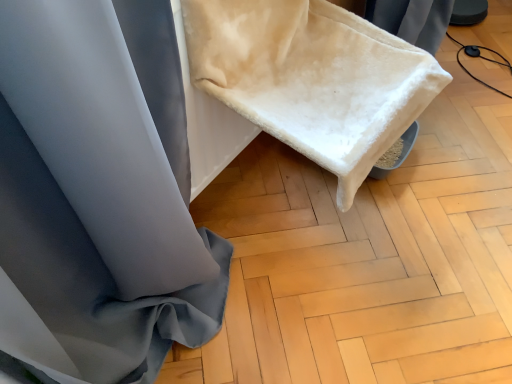
This screenshot has width=512, height=384. I want to click on white fluffy blanket at upper center, so click(x=312, y=78).

The image size is (512, 384). Describe the element at coordinates (312, 78) in the screenshot. I see `white fluffy blanket at upper center` at that location.

The width and height of the screenshot is (512, 384). What are the coordinates of `white soft fabric at lower right` in the screenshot? It's located at (368, 259).

This screenshot has width=512, height=384. What do you see at coordinates (368, 259) in the screenshot?
I see `white soft fabric at lower right` at bounding box center [368, 259].

Locate an element on the screen. Image resolution: width=512 pixels, height=384 pixels. white fluffy blanket at upper center is located at coordinates (312, 78).

Can you confirm if white soft fabric at lower right is positioned to the right of white fluffy blanket at upper center?

Yes, white soft fabric at lower right is to the right of white fluffy blanket at upper center.

Does white soft fabric at lower right come in front of white fluffy blanket at upper center?

No.

Is point (315, 363) farther from camera compared to point (348, 183)?

Yes, it is.

From the image's perspective, which one is positioned higher, white soft fabric at lower right or white fluffy blanket at upper center?

white fluffy blanket at upper center, from the image's perspective.

From a real-world perspective, is white soft fabric at lower right below white fluffy blanket at upper center?

Yes, from a real-world perspective, white soft fabric at lower right is under white fluffy blanket at upper center.

Which object is thinner, white soft fabric at lower right or white fluffy blanket at upper center?

Thinner between the two is white fluffy blanket at upper center.

Who is taller, white soft fabric at lower right or white fluffy blanket at upper center?

white fluffy blanket at upper center is taller.

Is white soft fabric at lower right bigger than white fluffy blanket at upper center?

No, white soft fabric at lower right is not bigger than white fluffy blanket at upper center.

Can white fluffy blanket at upper center be found inside white soft fabric at lower right?

Actually, white fluffy blanket at upper center is outside white soft fabric at lower right.

Is the surface of white soft fabric at lower right in direct contact with white fluffy blanket at upper center?

No, white soft fabric at lower right is not making contact with white fluffy blanket at upper center.

Looking at this image, is white soft fabric at lower right aimed at white fluffy blanket at upper center?

No, white soft fabric at lower right is not facing towards white fluffy blanket at upper center.

How different are the orientations of white soft fabric at lower right and white fluffy blanket at upper center in degrees?

89.1 degrees separate the facing orientations of white soft fabric at lower right and white fluffy blanket at upper center.

Where is `wide in front of the white soft fabric at lower right`? This screenshot has width=512, height=384. wide in front of the white soft fabric at lower right is located at coordinates (312, 78).

Is white fluffy blanket at upper center at the right side of white soft fabric at lower right?

Incorrect, white fluffy blanket at upper center is not on the right side of white soft fabric at lower right.

Considering the positions of objects white fluffy blanket at upper center and white soft fabric at lower right in the image provided, who is in front, white fluffy blanket at upper center or white soft fabric at lower right?

white fluffy blanket at upper center is closer to the camera.

Which point is more forward, [356,19] or [425,233]?

The point [356,19] is closer to the camera.

From the image's perspective, is white fluffy blanket at upper center located beneath white soft fabric at lower right?

No, from the image's perspective, white fluffy blanket at upper center is not beneath white soft fabric at lower right.

From a real-world perspective, who is located higher, white fluffy blanket at upper center or white soft fabric at lower right?

white fluffy blanket at upper center.

Based on the photo, can you confirm if white fluffy blanket at upper center is thinner than white soft fabric at lower right?

Indeed, white fluffy blanket at upper center has a lesser width compared to white soft fabric at lower right.

Considering the relative sizes of white fluffy blanket at upper center and white soft fabric at lower right in the image provided, is white fluffy blanket at upper center shorter than white soft fabric at lower right?

No.

Between white fluffy blanket at upper center and white soft fabric at lower right, which one has larger size?

white fluffy blanket at upper center.

Could white soft fabric at lower right be considered to be inside white fluffy blanket at upper center?

No, white soft fabric at lower right is not a part of white fluffy blanket at upper center.

Is white fluffy blanket at upper center with white soft fabric at lower right?

No, white fluffy blanket at upper center is not next to white soft fabric at lower right.

Is white fluffy blanket at upper center facing away from white soft fabric at lower right?

No, white fluffy blanket at upper center is not facing the opposite direction of white soft fabric at lower right.

How different are the orientations of white fluffy blanket at upper center and white soft fabric at lower right in degrees?

white fluffy blanket at upper center and white soft fabric at lower right are facing 89.1 degrees away from each other.

How distant is white fluffy blanket at upper center from white soft fabric at lower right?

white fluffy blanket at upper center and white soft fabric at lower right are 19.46 inches apart from each other.

You are a GUI agent. You are given a task and a screenshot of the screen. Output one action in this format:
    pyautogui.click(x=<x>, y=<y>)
    Task: Click on the wood below the white fluffy blanket at upper center (from a real-world perspective)
    The width and height of the screenshot is (512, 384).
    Given the screenshot: What is the action you would take?
    click(x=368, y=259)

Locate an element on the screen. wide on the left of the white soft fabric at lower right is located at coordinates (312, 78).

This screenshot has height=384, width=512. I want to click on wood below the white fluffy blanket at upper center (from the image's perspective), so click(368, 259).